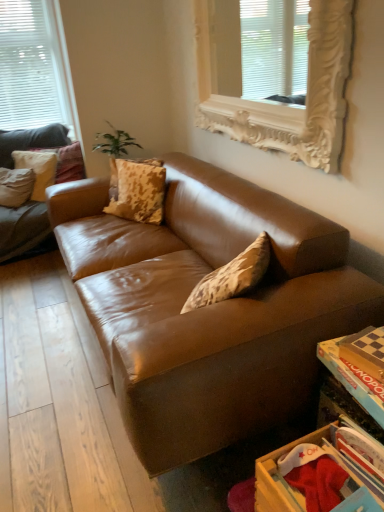
Where is `vacant point above wooden drawer at lower right (from a real-world perspective)`? vacant point above wooden drawer at lower right (from a real-world perspective) is located at coordinates (344, 456).